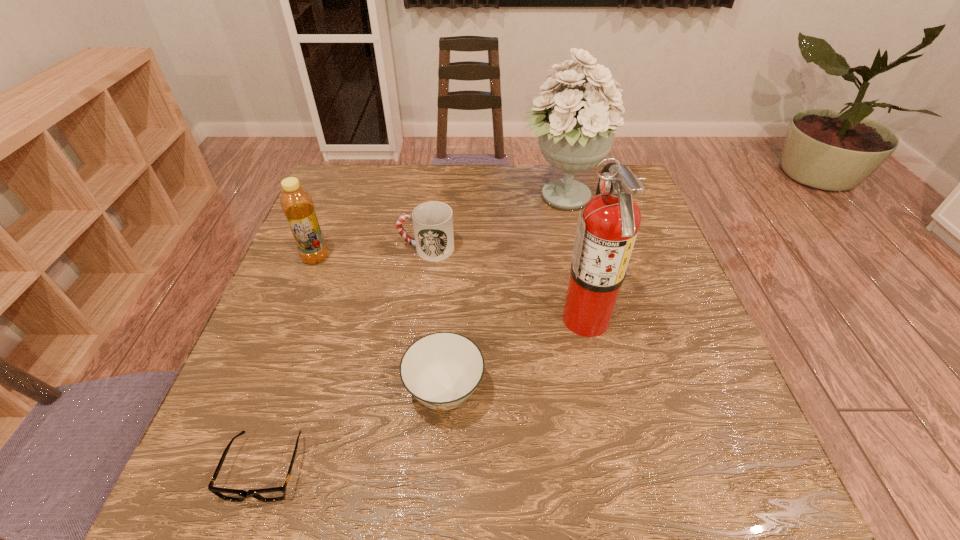
I want to click on vacant point located between the third tallest object and the fifth farthest object, so click(380, 323).

The image size is (960, 540). I want to click on unoccupied area between the second nearest object and the nearest object, so click(x=355, y=429).

At what (x,y) coordinates should I click in order to perform the action: click on free spot between the farthest object and the soup bowl. Please return your answer as a coordinate pair (x, y). The image size is (960, 540). Looking at the image, I should click on (503, 294).

I want to click on free point between the fire extinguisher and the fifth tallest object, so click(x=516, y=354).

Where is `free space between the soup bowl and the farthest object`? Image resolution: width=960 pixels, height=540 pixels. free space between the soup bowl and the farthest object is located at coordinates (503, 294).

The image size is (960, 540). Find the location of `blank region between the fourth shortest object and the second nearest object`. blank region between the fourth shortest object and the second nearest object is located at coordinates (380, 323).

The image size is (960, 540). What are the coordinates of `free area in between the shortest object and the second nearest object` in the screenshot? It's located at (355, 429).

This screenshot has width=960, height=540. I want to click on free space between the fourth tallest object and the bottle, so click(x=372, y=253).

Identify which object is the second closest to the fourth farthest object. Please provide its 2D coordinates. Your answer should be formatted as a tuple, i.e. [(x, y)], where the tuple contains the x and y coordinates of a point satisfying the conditions above.

[(575, 128)]

Where is `object that is the second closest to the fire extinguisher`? This screenshot has height=540, width=960. object that is the second closest to the fire extinguisher is located at coordinates (575, 128).